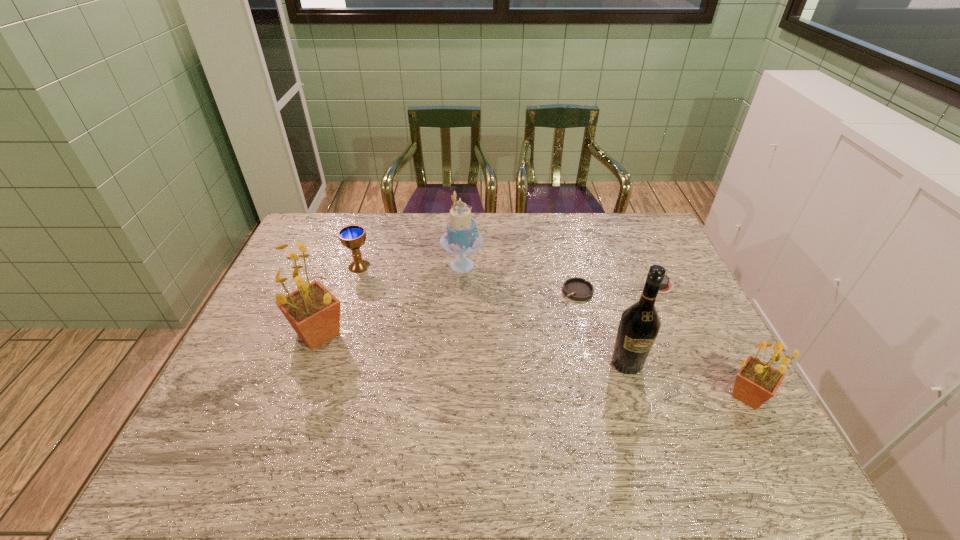
This screenshot has height=540, width=960. I want to click on free location located at the front of the left sunflower with flowers visible, so click(252, 334).

Find the location of `vacant space located 0.190m with a ladder on the side of the cake`. vacant space located 0.190m with a ladder on the side of the cake is located at coordinates (x=540, y=265).

Where is `blank space located on the left of the chocolate cake`? blank space located on the left of the chocolate cake is located at coordinates (562, 284).

The width and height of the screenshot is (960, 540). In order to click on vacant space located 0.270m on the right of the chalice in this screenshot , I will do (455, 266).

Where is `free region located on the front of the ashtray`? free region located on the front of the ashtray is located at coordinates (607, 410).

I want to click on vacant space situated 0.070m on the label of the wine bottle, so (x=638, y=402).

You are a GUI agent. You are given a task and a screenshot of the screen. Output one action in this format:
    pyautogui.click(x=<x>, y=<y>)
    Task: Click on the object that is positioned at the near edge
    This screenshot has width=960, height=540.
    Given the screenshot: What is the action you would take?
    pyautogui.click(x=756, y=382)

The width and height of the screenshot is (960, 540). I want to click on object that is at the left edge, so click(x=314, y=312).

At what (x,y) coordinates should I click in order to perform the action: click on sunflower present at the right edge. Please return your answer as a coordinate pair (x, y). Image resolution: width=960 pixels, height=540 pixels. Looking at the image, I should click on (756, 382).

What are the coordinates of `chocolate cake at the right edge` in the screenshot? It's located at (667, 285).